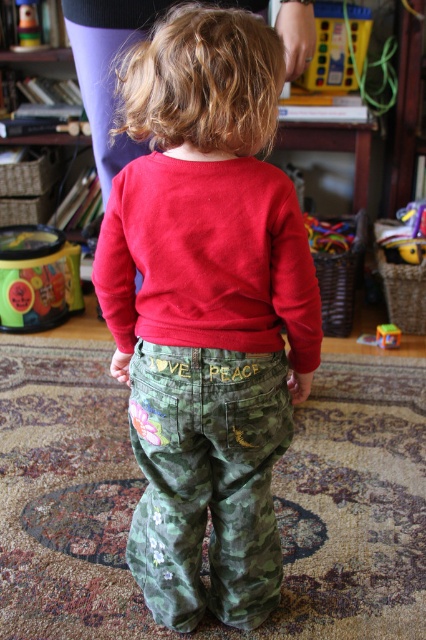
Question: Is camo fabric pants at center further to the viewer compared to rubber duck at lower right?

Choices:
 (A) yes
 (B) no

Answer: (B)

Question: Considering the relative positions of rubber duck at lower right and matte plastic toy at center in the image provided, where is rubber duck at lower right located with respect to matte plastic toy at center?

Choices:
 (A) above
 (B) below

Answer: (A)

Question: Is camo pants at center smaller than rubberized plastic toy at upper left?

Choices:
 (A) yes
 (B) no

Answer: (B)

Question: Among these objects, which one is nearest to the camera?

Choices:
 (A) rubberized plastic toy at upper center
 (B) matte plastic bucket at left
 (C) camo fabric pants at center

Answer: (C)

Question: Which point appears farthest from the camera in this image?

Choices:
 (A) (39, 33)
 (B) (244, 364)
 (C) (249, 412)
 (D) (46, 225)

Answer: (D)

Question: Which object is closer to the camera taking this photo?

Choices:
 (A) camo fabric pants at center
 (B) matte plastic bucket at left
 (C) rubberized plastic toy at upper center

Answer: (A)